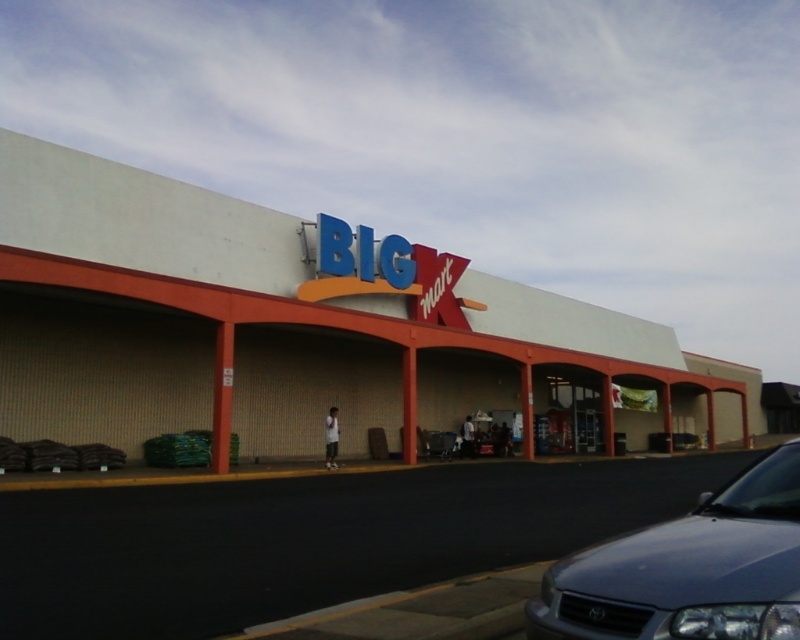
You are standing in front of the Big Kmart store and want to walk from the white concrete mall at center to the satin silver sedan at lower right. Which direction should you move relative to your current position?

You should move towards the lower right direction because the satin silver sedan at lower right is closer to you than the white concrete mall at center, which is further away.

You are standing at the entrance of the Big Kmart store and want to go to the parking lot. There are two points marked on the ground labeled point (x=112, y=296) and point (x=772, y=486). Which point is closer to the parking lot?

Point (x=112, y=296) is behind point (x=772, y=486), so point (x=772, y=486) is closer to the parking lot.